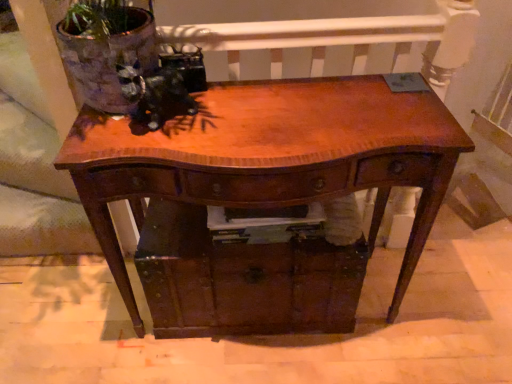
What do you see at coordinates (243, 278) in the screenshot? Image resolution: width=512 pixels, height=384 pixels. I see `wooden drawer at center` at bounding box center [243, 278].

Identify the location of wooden drawer at center. The width and height of the screenshot is (512, 384). (243, 278).

Locate an element on the screen. shiny brown wood table at center is located at coordinates (270, 156).

The height and width of the screenshot is (384, 512). What do you see at coordinates (270, 156) in the screenshot?
I see `shiny brown wood table at center` at bounding box center [270, 156].

This screenshot has width=512, height=384. In order to click on wooden drawer at center in this screenshot , I will do `click(243, 278)`.

Based on the photo, considering the relative positions of wooden drawer at center and shiny brown wood table at center in the image provided, is wooden drawer at center to the left of shiny brown wood table at center from the viewer's perspective?

Yes.

Which is in front, wooden drawer at center or shiny brown wood table at center?

shiny brown wood table at center is in front.

Which is in front, point (284, 303) or point (275, 109)?

The point (275, 109) is closer to the camera.

From the image's perspective, is wooden drawer at center located above or below shiny brown wood table at center?

Clearly, from the image's perspective, wooden drawer at center is below shiny brown wood table at center.

From a real-world perspective, relative to shiny brown wood table at center, is wooden drawer at center vertically above or below?

wooden drawer at center is situated lower than shiny brown wood table at center in the real world.

Considering the sizes of objects wooden drawer at center and shiny brown wood table at center in the image provided, who is thinner, wooden drawer at center or shiny brown wood table at center?

With smaller width is shiny brown wood table at center.

Is wooden drawer at center taller or shorter than shiny brown wood table at center?

wooden drawer at center is shorter than shiny brown wood table at center.

Based on the photo, does wooden drawer at center have a larger size compared to shiny brown wood table at center?

No, wooden drawer at center is not bigger than shiny brown wood table at center.

Is wooden drawer at center completely or partially outside of shiny brown wood table at center?

No, wooden drawer at center is not outside of shiny brown wood table at center.

Is wooden drawer at center placed right next to shiny brown wood table at center?

No, wooden drawer at center is not in contact with shiny brown wood table at center.

Is wooden drawer at center positioned with its back to shiny brown wood table at center?

Yes, wooden drawer at center is positioned with its back facing shiny brown wood table at center.

How many degrees apart are the facing directions of wooden drawer at center and shiny brown wood table at center?

wooden drawer at center and shiny brown wood table at center are facing 2.15 degrees away from each other.

Measure the distance from wooden drawer at center to shiny brown wood table at center.

They are 9.77 inches apart.

Image resolution: width=512 pixels, height=384 pixels. Identify the location of drawer behind the shiny brown wood table at center. (243, 278).

Does shiny brown wood table at center appear on the right side of wooden drawer at center?

Yes.

Does shiny brown wood table at center lie behind wooden drawer at center?

No, it is in front of wooden drawer at center.

Looking at this image, which is closer, (138, 318) or (222, 304)?

The point (222, 304) is closer to the camera.

From the image's perspective, which one is positioned higher, shiny brown wood table at center or wooden drawer at center?

From the image's view, shiny brown wood table at center is above.

From a real-world perspective, is shiny brown wood table at center above or below wooden drawer at center?

From a real-world perspective, shiny brown wood table at center is physically above wooden drawer at center.

Which object is wider, shiny brown wood table at center or wooden drawer at center?

With larger width is wooden drawer at center.

Which of these two, shiny brown wood table at center or wooden drawer at center, stands taller?

With more height is shiny brown wood table at center.

Looking at the image, does shiny brown wood table at center seem bigger or smaller compared to wooden drawer at center?

In the image, shiny brown wood table at center appears to be larger than wooden drawer at center.

Is wooden drawer at center inside shiny brown wood table at center?

That's correct, wooden drawer at center is inside shiny brown wood table at center.

Are shiny brown wood table at center and wooden drawer at center beside each other?

No, shiny brown wood table at center is not with wooden drawer at center.

Does shiny brown wood table at center turn towards wooden drawer at center?

Yes.

How much distance is there between shiny brown wood table at center and wooden drawer at center?

shiny brown wood table at center is 9.77 inches away from wooden drawer at center.

Locate an element on the screen. drawer that is on the left side of shiny brown wood table at center is located at coordinates (243, 278).

Where is `table above the wooden drawer at center (from a real-world perspective)`? table above the wooden drawer at center (from a real-world perspective) is located at coordinates (270, 156).

Locate an element on the screen. table that is in front of the wooden drawer at center is located at coordinates (270, 156).